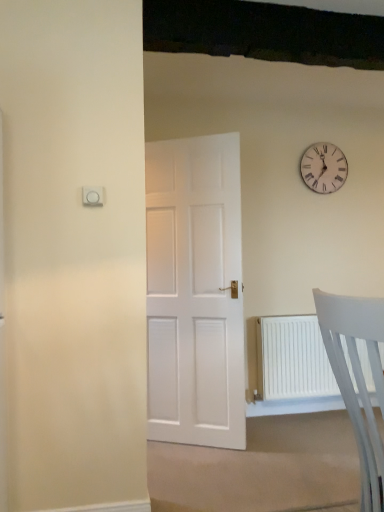
Question: From a real-world perspective, is white plastic chair at lower right physically located above or below white wooden clock at upper right?

Choices:
 (A) above
 (B) below

Answer: (B)

Question: Is white plastic chair at lower right inside or outside of white wooden clock at upper right?

Choices:
 (A) outside
 (B) inside

Answer: (A)

Question: Visually, is white plastic chair at lower right positioned to the left or to the right of white wooden clock at upper right?

Choices:
 (A) right
 (B) left

Answer: (B)

Question: Which is correct: white wooden clock at upper right is inside white plastic chair at lower right, or outside of it?

Choices:
 (A) inside
 (B) outside

Answer: (B)

Question: Is white wooden clock at upper right taller or shorter than white plastic chair at lower right?

Choices:
 (A) tall
 (B) short

Answer: (B)

Question: Does point (336, 177) appear closer or farther from the camera than point (334, 295)?

Choices:
 (A) farther
 (B) closer

Answer: (A)

Question: From the image's perspective, is white wooden clock at upper right above or below white plastic chair at lower right?

Choices:
 (A) below
 (B) above

Answer: (B)